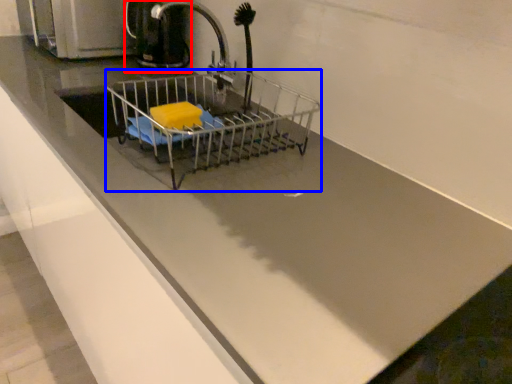
Question: Among these objects, which one is nearest to the camera, coffeepot (highlighted by a red box) or shopping cart (highlighted by a blue box)?

Choices:
 (A) coffeepot
 (B) shopping cart

Answer: (B)